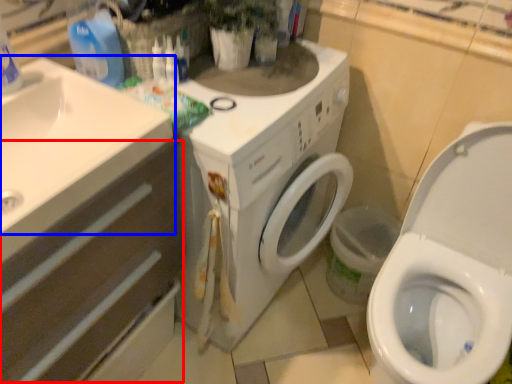
Question: Which point is further to the camera, drawer (highlighted by a red box) or sink (highlighted by a blue box)?

Choices:
 (A) drawer
 (B) sink

Answer: (B)